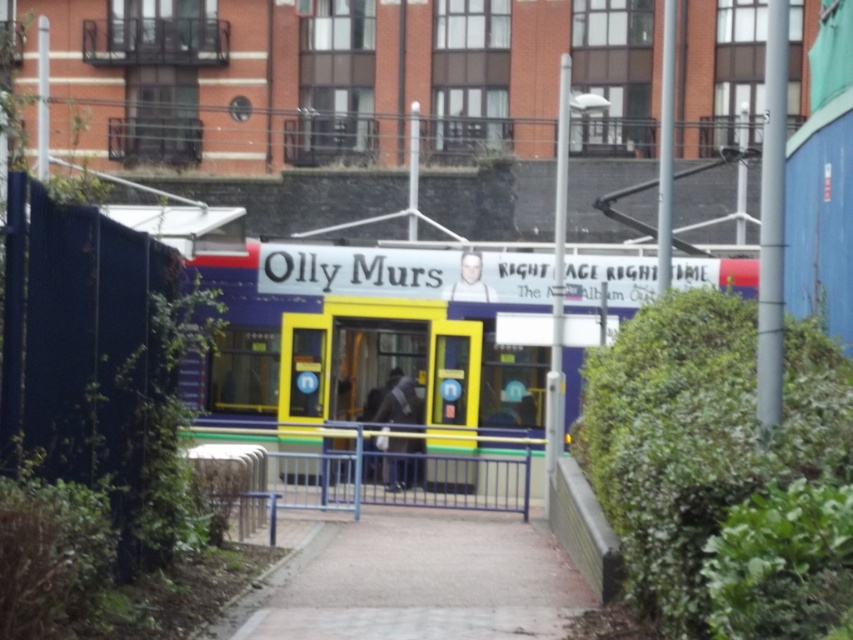
You are a toy collector who wants to place both the yellow plastic train at center and the blue metallic rail at center on a shelf. If the shelf has a width limit of 15 cm, which object might not fit if placed alone?

The blue metallic rail at center has a greater width than the yellow plastic train at center, so the blue metallic rail at center might not fit on the shelf if placed alone.

You are a parent trying to decide whether to let your child play with the yellow plastic train at center and the blue metallic rail at center. Considering the height of the objects, which one is safer for a child to interact with?

The yellow plastic train at center has a lesser height compared to the blue metallic rail at center, so the yellow plastic train at center is safer for a child to interact with since it is shorter and less likely to cause injury if the child trips over it.